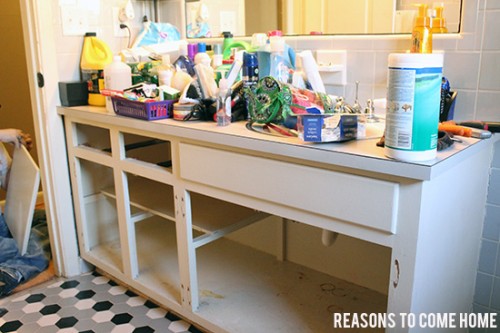
The height and width of the screenshot is (333, 500). What are the coordinates of `cabinet door` in the screenshot? It's located at (18, 176).